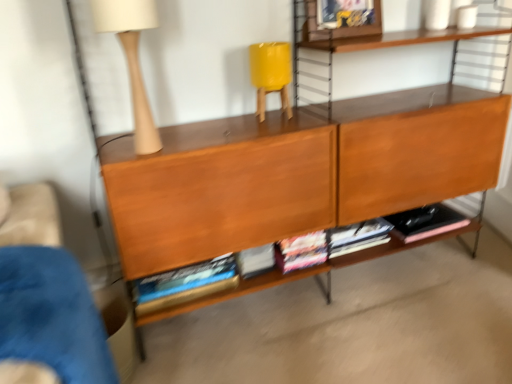
Question: Considering the relative positions of matte beige table lamp at upper left and blue fabric armchair at lower left in the image provided, is matte beige table lamp at upper left to the right of blue fabric armchair at lower left from the viewer's perspective?

Choices:
 (A) yes
 (B) no

Answer: (A)

Question: Is matte beige table lamp at upper left positioned far away from blue fabric armchair at lower left?

Choices:
 (A) yes
 (B) no

Answer: (B)

Question: From a real-world perspective, is matte beige table lamp at upper left under blue fabric armchair at lower left?

Choices:
 (A) no
 (B) yes

Answer: (A)

Question: Does matte beige table lamp at upper left have a lesser height compared to blue fabric armchair at lower left?

Choices:
 (A) no
 (B) yes

Answer: (B)

Question: Would you say matte beige table lamp at upper left is outside blue fabric armchair at lower left?

Choices:
 (A) yes
 (B) no

Answer: (A)

Question: Can you confirm if matte beige table lamp at upper left is wider than blue fabric armchair at lower left?

Choices:
 (A) yes
 (B) no

Answer: (B)

Question: From a real-world perspective, is hardcover books at center beneath blue fabric armchair at lower left?

Choices:
 (A) yes
 (B) no

Answer: (A)

Question: Is hardcover books at center positioned behind blue fabric armchair at lower left?

Choices:
 (A) no
 (B) yes

Answer: (B)

Question: Is hardcover books at center oriented towards blue fabric armchair at lower left?

Choices:
 (A) yes
 (B) no

Answer: (B)

Question: Does hardcover books at center have a larger size compared to blue fabric armchair at lower left?

Choices:
 (A) yes
 (B) no

Answer: (B)

Question: Can you see hardcover books at center touching blue fabric armchair at lower left?

Choices:
 (A) yes
 (B) no

Answer: (B)

Question: From a real-world perspective, is hardcover books at center located higher than blue fabric armchair at lower left?

Choices:
 (A) no
 (B) yes

Answer: (A)

Question: Does blue fabric armchair at lower left turn towards hardcover books at center?

Choices:
 (A) yes
 (B) no

Answer: (B)